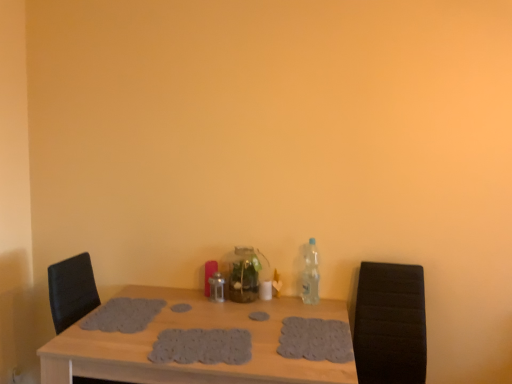
This screenshot has height=384, width=512. Find the location of `free space to the back side of gray knitted placemat at center, positioned as the 2th footprint in left-to-right order`. free space to the back side of gray knitted placemat at center, positioned as the 2th footprint in left-to-right order is located at coordinates (208, 318).